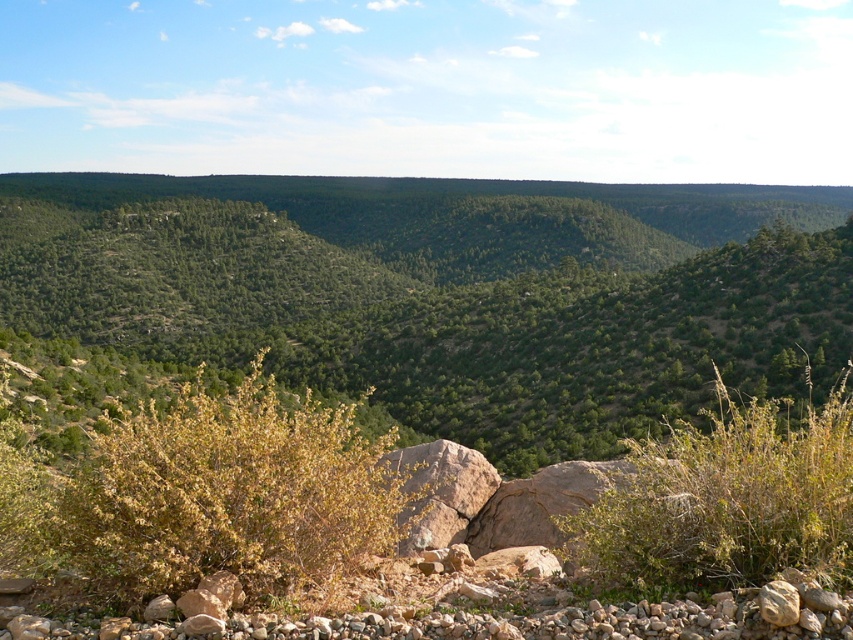
Looking at this image, does brown dry bush at lower left appear under green leafy bush at center?

Answer: Yes, brown dry bush at lower left is below green leafy bush at center.

This screenshot has width=853, height=640. What are the coordinates of `brown dry bush at lower left` in the screenshot? It's located at 219,493.